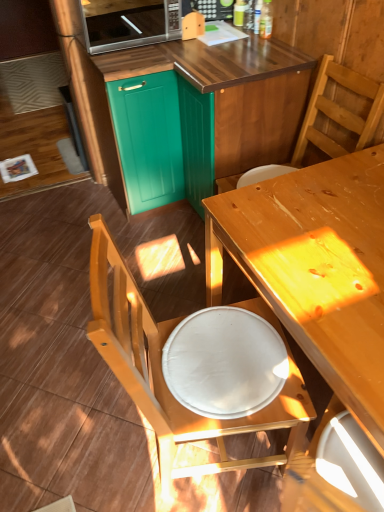
In order to click on blank space situated above teal matte cabinet at upper center, arranged as the second cabinetry when viewed from the right (from a real-world perspective) in this screenshot , I will do `click(118, 40)`.